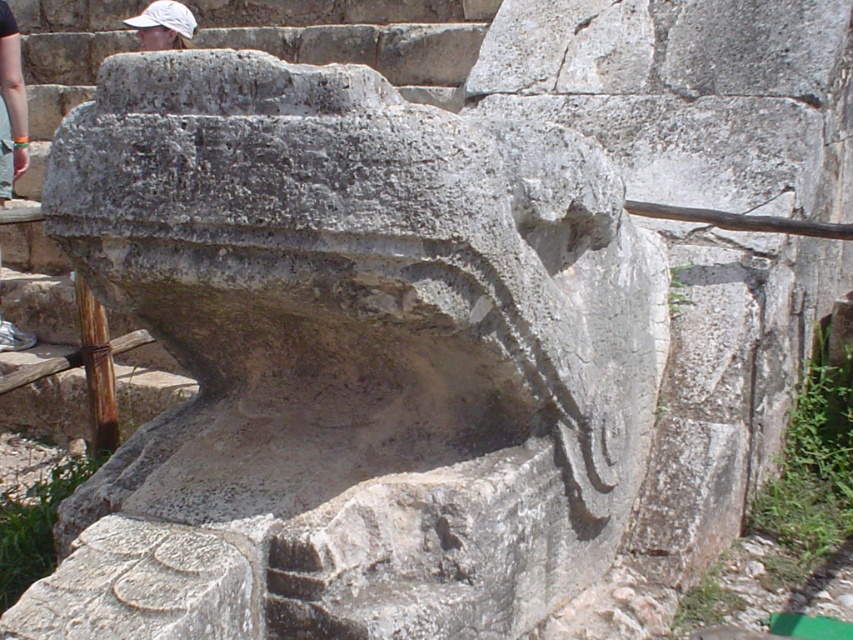
You are an archaeologist examining the gray stone carving at center and the white fabric at upper left. Which object would you need a magnifying glass to examine more closely, considering their sizes?

The white fabric at upper left is smaller than the gray stone carving at center, so you would need a magnifying glass to examine the white fabric at upper left more closely due to its smaller size.

You are a tour guide standing 1.56 meters away from the gray stone carving at center. You need to explain the carving to a group of visitors who are standing 1.2 meters behind you. Can the visitors see the carving clearly from their position?

The gray stone carving at center is 1.56 meters away from the viewer. Since the visitors are 1.2 meters behind the tour guide, their distance from the carving would be 1.56 meters plus 1.2 meters, totaling 2.76 meters. At this distance, the visitors may still be able to see the carving clearly, though it might appear smaller and less detailed compared to the tour guide.